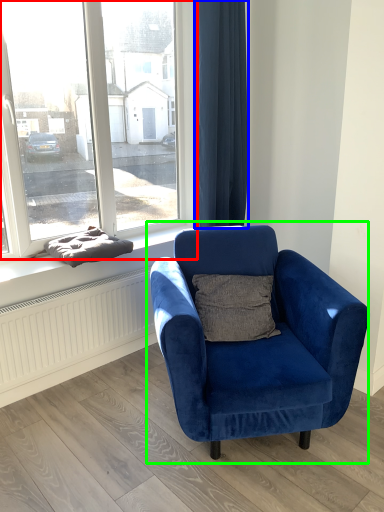
Question: Considering the real-world distances, which object is closest to window (highlighted by a red box)? curtain (highlighted by a blue box) or chair (highlighted by a green box).

Choices:
 (A) curtain
 (B) chair

Answer: (A)